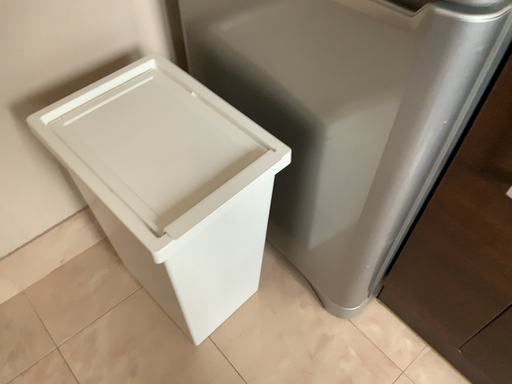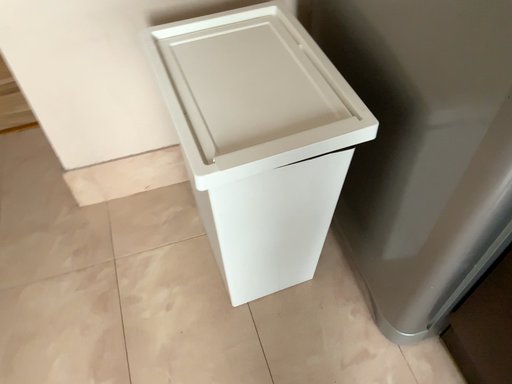
Question: How did the camera likely rotate when shooting the video?

Choices:
 (A) rotated right
 (B) rotated left

Answer: (B)